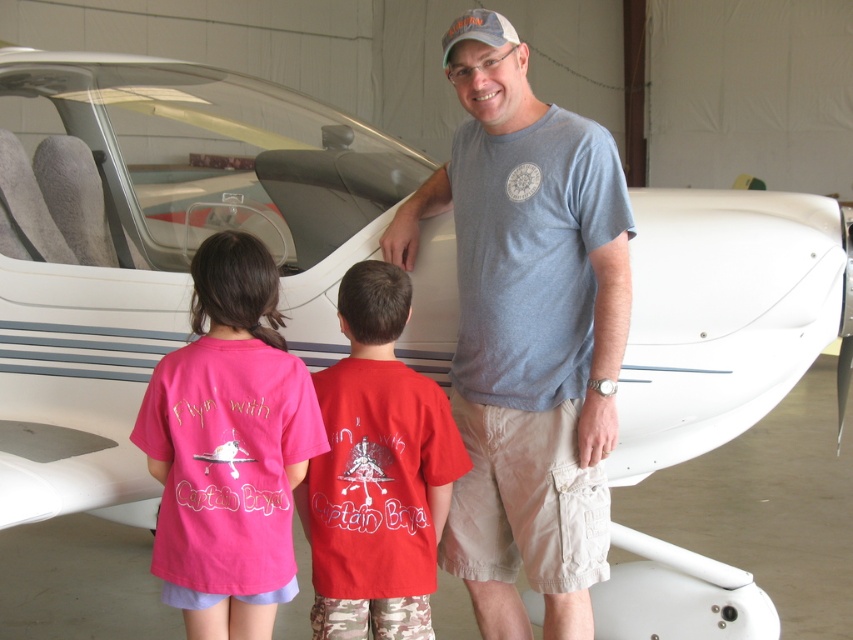
You are standing in the hangar and see the point at coordinates (228, 448). Which object is this point located on?

The point at (228, 448) is located on the pink fabric shirt at center.